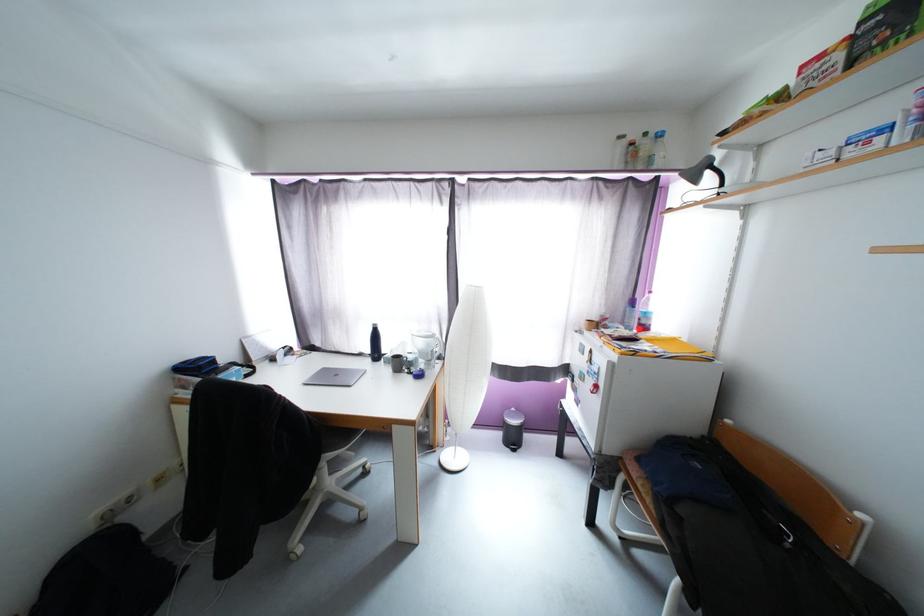
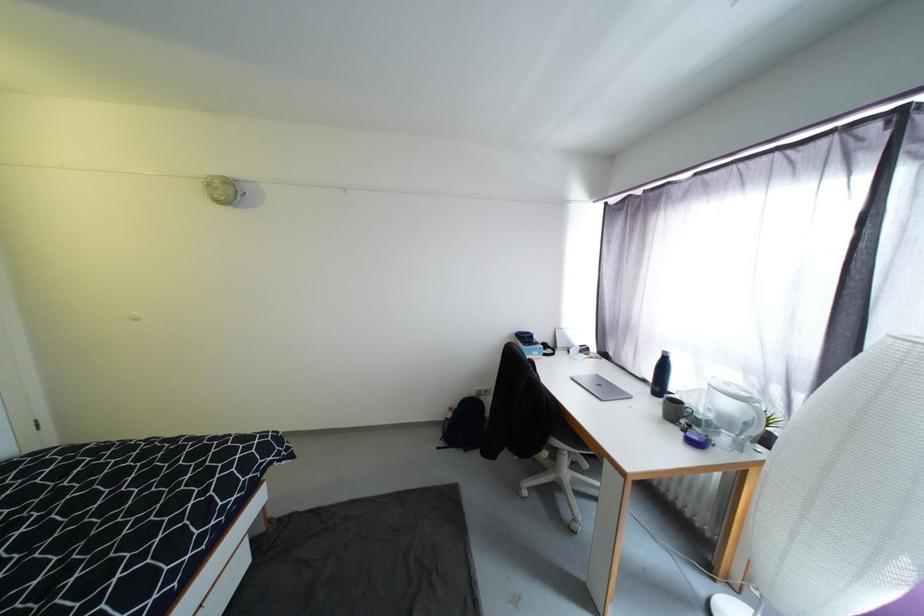
The point at [424,333] is marked in the first image. Where is the corresponding point in the second image?

(733, 386)